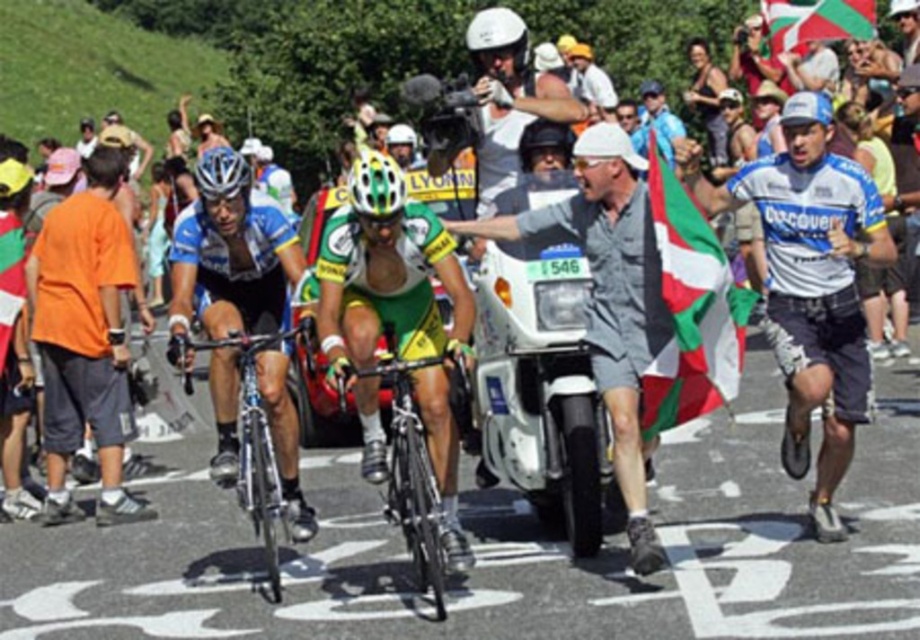
Does blue jersey cyclist at left have a lesser height compared to green fabric flag at upper center?

No.

Who is more forward, (226, 269) or (812, 35)?

Point (226, 269)

Describe the element at coordinates (230, 256) in the screenshot. The image size is (920, 640). I see `blue jersey cyclist at left` at that location.

You are a GUI agent. You are given a task and a screenshot of the screen. Output one action in this format:
    pyautogui.click(x=<x>, y=<y>)
    Task: Click on the blue jersey cyclist at left
    
    Given the screenshot: What is the action you would take?
    pyautogui.click(x=230, y=256)

Does white plastic motorcycle at center have a lesser height compared to white matte bicycle helmet at center?

Yes, white plastic motorcycle at center is shorter than white matte bicycle helmet at center.

Which is behind, point (512, 304) or point (248, 182)?

Positioned behind is point (512, 304).

Is point (548, 333) farther from camera compared to point (215, 161)?

Yes.

Locate an element on the screen. white plastic motorcycle at center is located at coordinates (541, 387).

Can you confirm if shiny black frame at center is smaller than green fabric flag at upper center?

Yes.

This screenshot has width=920, height=640. I want to click on shiny black frame at center, so click(255, 444).